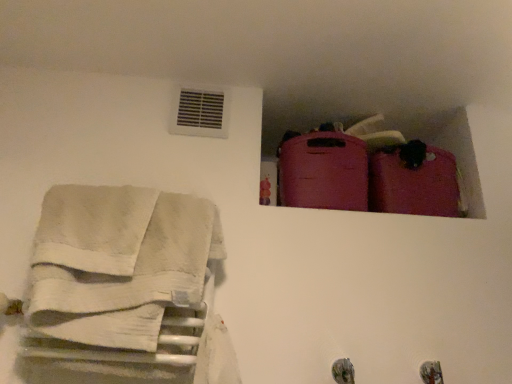
Question: In terms of width, does matte pink suitcase at upper right, which is the second luggage in right-to-left order, look wider or thinner when compared to matte pink suitcase at upper right, the second luggage in the left-to-right sequence?

Choices:
 (A) thin
 (B) wide

Answer: (B)

Question: In the image, is matte pink suitcase at upper right, which is the second luggage in right-to-left order, positioned in front of or behind matte pink suitcase at upper right, marked as the 1th luggage in a right-to-left arrangement?

Choices:
 (A) behind
 (B) front

Answer: (B)

Question: Which is nearer to the white cotton towels at left?

Choices:
 (A) white plastic vent at upper center
 (B) matte pink suitcase at upper right, which is the second luggage in right-to-left order
 (C) matte pink suitcase at upper right, the second luggage in the left-to-right sequence

Answer: (A)

Question: Estimate the real-world distances between objects in this image. Which object is farther from the matte pink suitcase at upper right, marked as the 1th luggage in a right-to-left arrangement?

Choices:
 (A) white cotton towels at left
 (B) matte pink suitcase at upper right, the 1th luggage in the left-to-right sequence
 (C) white plastic vent at upper center

Answer: (A)